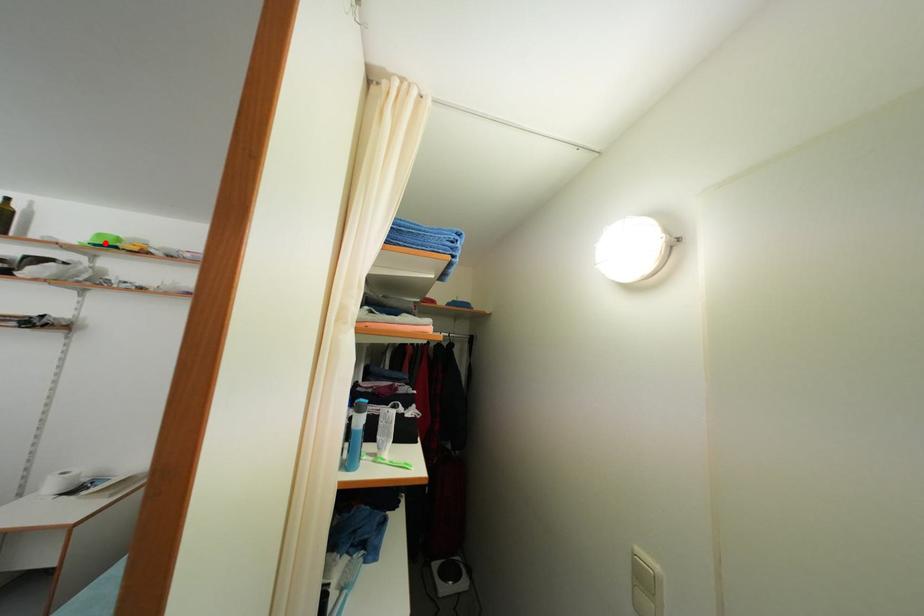
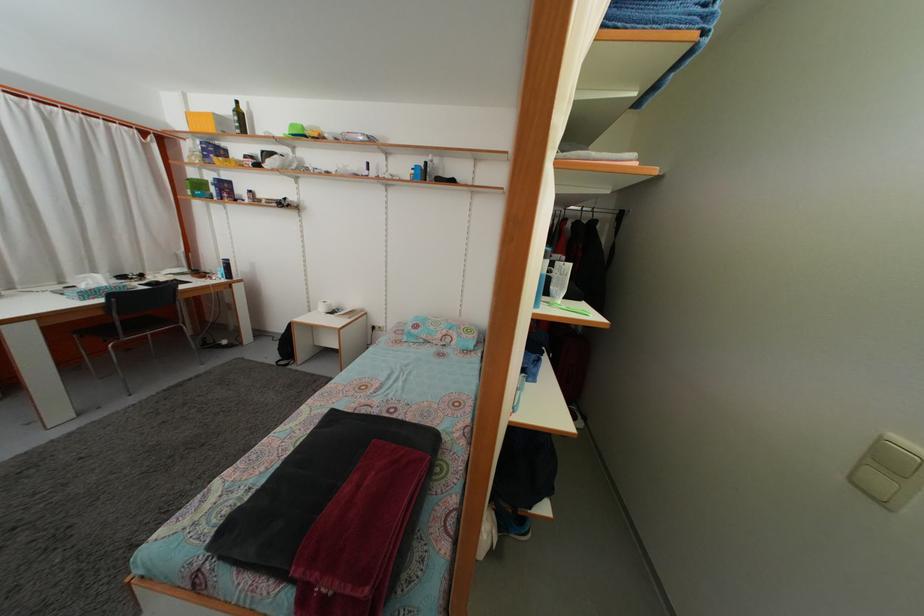
In the second image, find the point that corresponds to the highlighted location in the first image.

(298, 132)